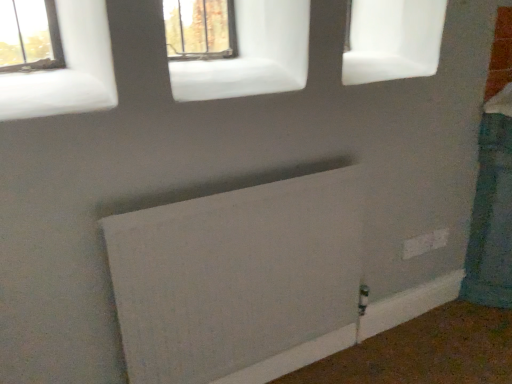
Question: From a real-world perspective, is white matte window at upper left, the second window when ordered from top to bottom, located beneath white plastic electric outlet at lower right?

Choices:
 (A) no
 (B) yes

Answer: (A)

Question: Does white matte window at upper left, the second window when ordered from top to bottom, have a lesser height compared to white plastic electric outlet at lower right?

Choices:
 (A) no
 (B) yes

Answer: (A)

Question: From a real-world perspective, is white matte window at upper left, the 1th window in the front-to-back sequence, on top of white plastic electric outlet at lower right?

Choices:
 (A) yes
 (B) no

Answer: (A)

Question: Would you consider white matte window at upper left, the 2th window positioned from the right, to be distant from white plastic electric outlet at lower right?

Choices:
 (A) no
 (B) yes

Answer: (B)

Question: Is white matte window at upper left, the 2th window positioned from the right, facing away from white plastic electric outlet at lower right?

Choices:
 (A) yes
 (B) no

Answer: (B)

Question: Considering the relative sizes of white matte window at upper left, the 1th window in the front-to-back sequence, and white plastic electric outlet at lower right in the image provided, is white matte window at upper left, the 1th window in the front-to-back sequence, bigger than white plastic electric outlet at lower right?

Choices:
 (A) no
 (B) yes

Answer: (B)

Question: Can you confirm if white matte window at upper left, which ranks as the 2th window in back-to-front order, is wider than white matte radiator at lower center?

Choices:
 (A) no
 (B) yes

Answer: (B)

Question: Considering the relative sizes of white matte window at upper left, which is the first window from left to right, and white matte radiator at lower center in the image provided, is white matte window at upper left, which is the first window from left to right, smaller than white matte radiator at lower center?

Choices:
 (A) no
 (B) yes

Answer: (B)

Question: Are white matte window at upper left, the second window when ordered from top to bottom, and white matte radiator at lower center located far from each other?

Choices:
 (A) no
 (B) yes

Answer: (A)

Question: From the image's perspective, does white matte window at upper left, which appears as the first window when ordered from the bottom, appear higher than white matte radiator at lower center?

Choices:
 (A) no
 (B) yes

Answer: (B)

Question: Is white matte window at upper left, the 1th window in the front-to-back sequence, touching white matte radiator at lower center?

Choices:
 (A) no
 (B) yes

Answer: (A)

Question: Can you confirm if white matte window at upper left, which is the first window from left to right, is shorter than white matte radiator at lower center?

Choices:
 (A) no
 (B) yes

Answer: (B)

Question: Is matte glass window at upper center, the 1th window positioned from the right, at the left side of white plastic electric outlet at lower right?

Choices:
 (A) no
 (B) yes

Answer: (B)